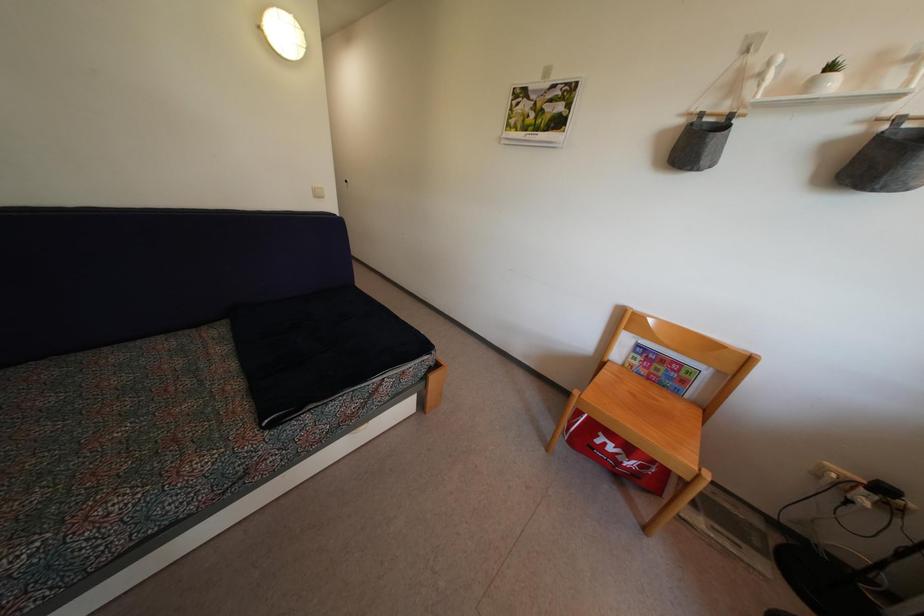
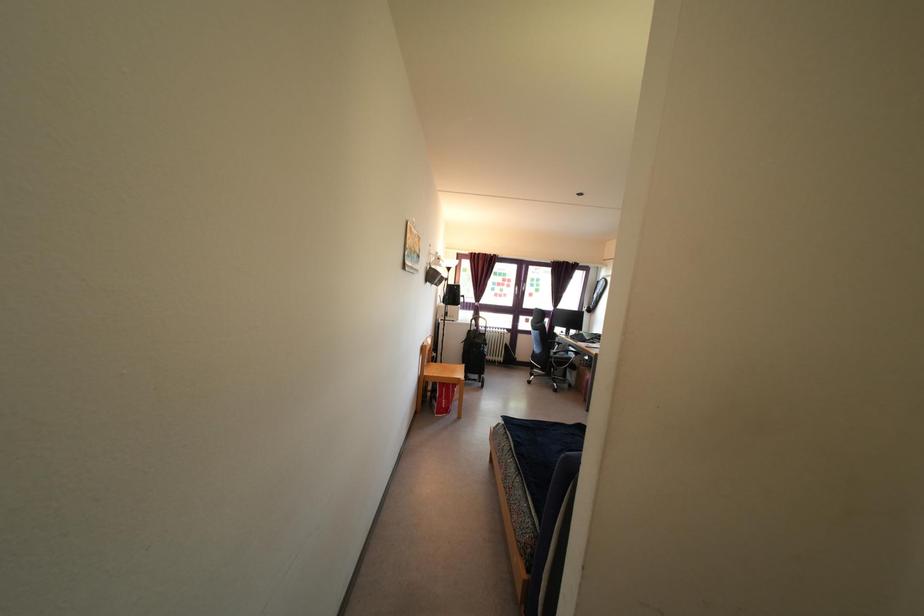
Question: I am providing you with two images of the same scene from different viewpoints. Please identify which objects are invisible in image2.

Choices:
 (A) red bag
 (B) black and white cap
 (C) black trolley handle
 (D) small potted plant

Answer: (D)